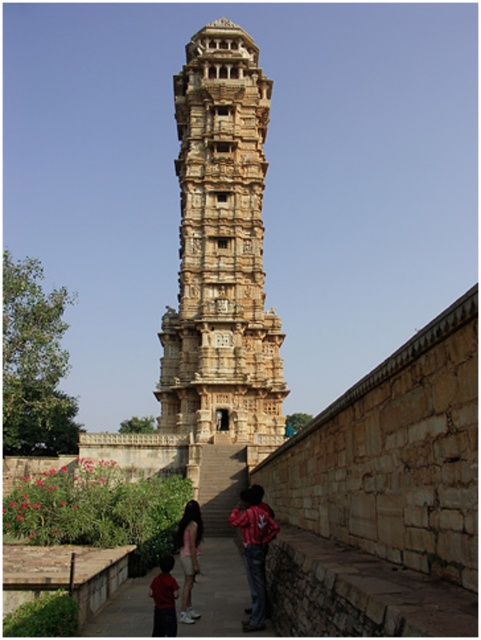
Between red and white textured shirt at center and light pink fabric at lower center, which one has more height?

red and white textured shirt at center is taller.

Image resolution: width=481 pixels, height=640 pixels. Identify the location of red and white textured shirt at center. (254, 548).

Locate an element on the screen. red and white textured shirt at center is located at coordinates (254, 548).

Between point (266, 532) and point (151, 596), which one is positioned behind?

The point (151, 596) is more distant.

Does red and white textured shirt at center appear under matte red shirt at lower center?

Actually, red and white textured shirt at center is above matte red shirt at lower center.

Is point (258, 554) positioned after point (164, 621)?

Yes, point (258, 554) is farther from viewer.

The width and height of the screenshot is (481, 640). Identify the location of red and white textured shirt at center. (254, 548).

Is light pink fabric at lower center above matte red shirt at lower center?

Correct, light pink fabric at lower center is located above matte red shirt at lower center.

Measure the distance between light pink fabric at lower center and camera.

The distance of light pink fabric at lower center from camera is 158.13 feet.

Where is `light pink fabric at lower center`? The image size is (481, 640). light pink fabric at lower center is located at coordinates (189, 556).